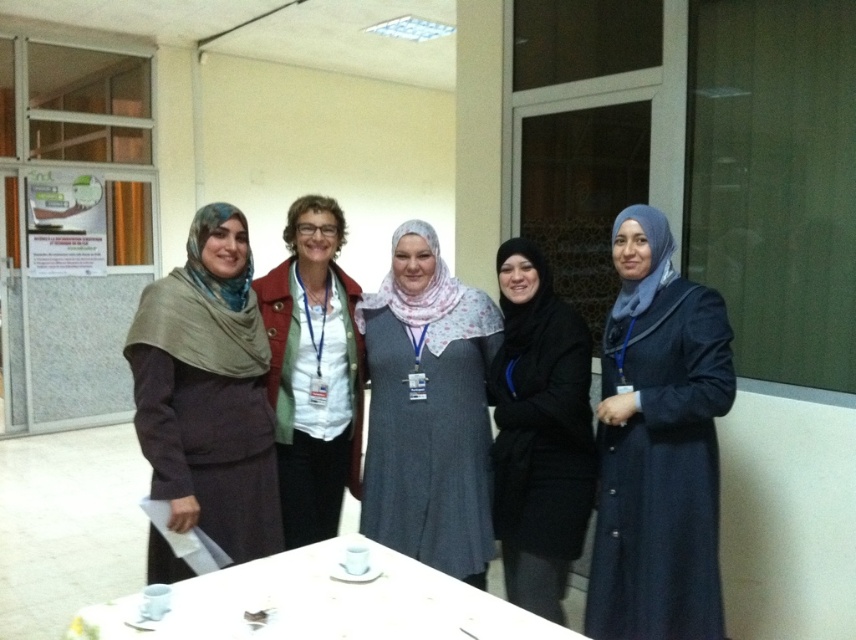
Is matte brown scarf at center below white glossy table at lower center?

Actually, matte brown scarf at center is above white glossy table at lower center.

This screenshot has width=856, height=640. I want to click on matte brown scarf at center, so click(207, 392).

Between matte brown scarf at center and gray fabric dress at center, which one is positioned higher?

matte brown scarf at center is above.

Which is in front, point (214, 224) or point (437, 380)?

Positioned in front is point (214, 224).

The width and height of the screenshot is (856, 640). What do you see at coordinates (207, 392) in the screenshot?
I see `matte brown scarf at center` at bounding box center [207, 392].

This screenshot has height=640, width=856. I want to click on matte brown scarf at center, so click(207, 392).

Is blue matte hijab at center thinner than matte brown scarf at center?

Yes, blue matte hijab at center is thinner than matte brown scarf at center.

Can you confirm if blue matte hijab at center is shorter than matte brown scarf at center?

In fact, blue matte hijab at center may be taller than matte brown scarf at center.

Between point (599, 492) and point (209, 236), which one is positioned in front?

Positioned in front is point (209, 236).

Locate an element on the screen. This screenshot has width=856, height=640. blue matte hijab at center is located at coordinates (658, 445).